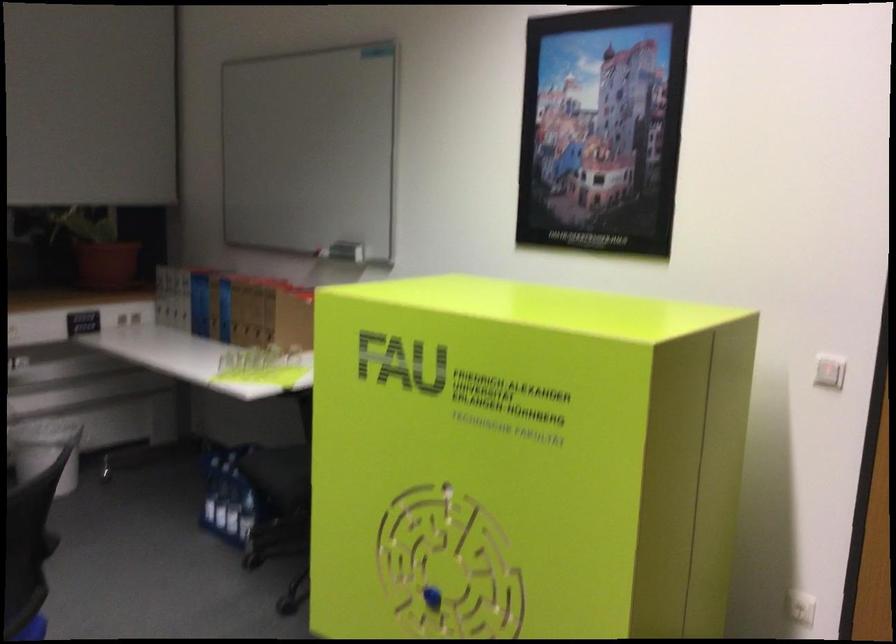
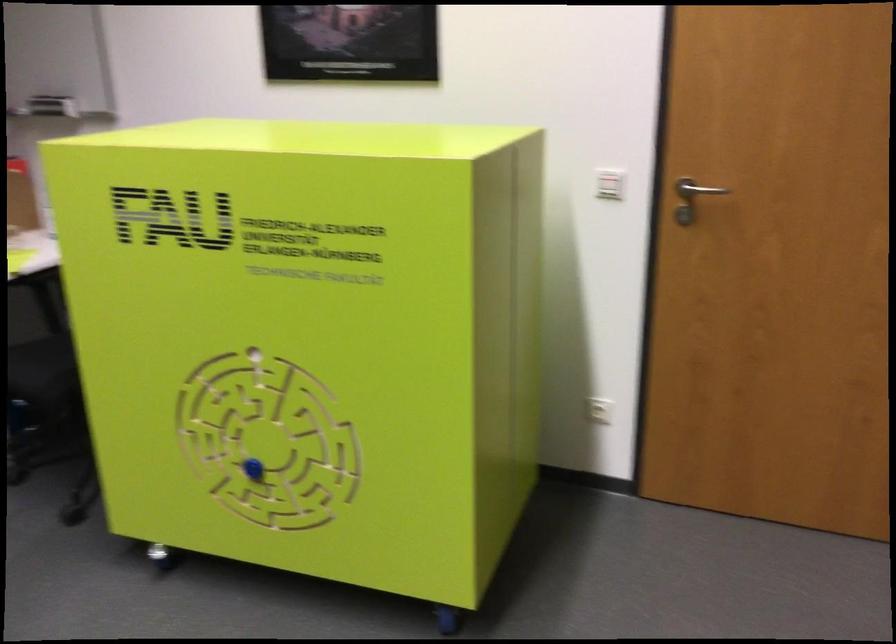
Based on the photo, the images are taken continuously from a first-person perspective. In which direction are you moving?

The movement direction of the cameraman is left, forward.